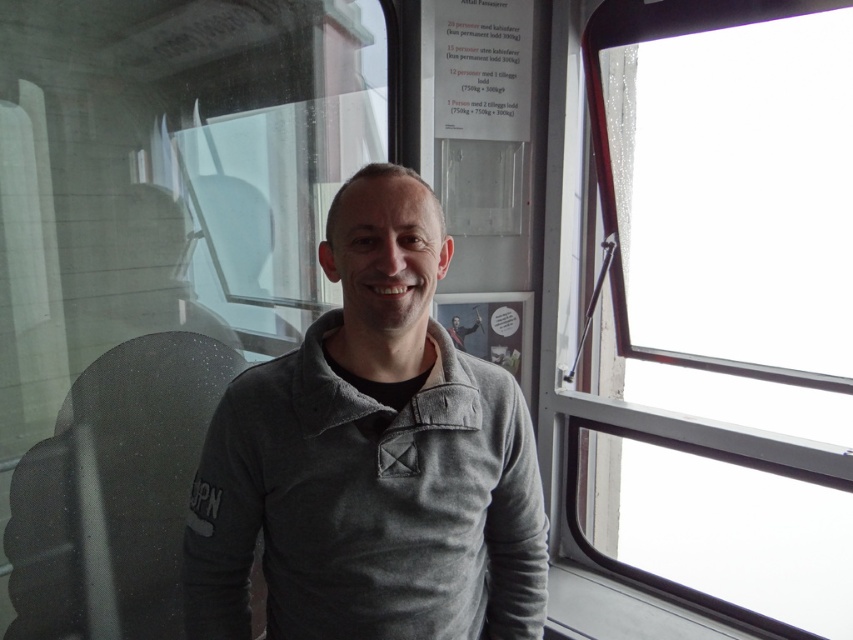
You are a passenger on a train and want to know which point is closer to you. The points are point [573,456] and point [252,552]. Which point is closer to you?

Point [252,552] is closer to you because it is less further to the viewer than point [573,456].

You are a passenger on a train and want to look outside. You see the clear glass window at right and the gray fleece sweater at center. Which object is located to the right of the other?

The clear glass window at right is to the right of the gray fleece sweater at center.